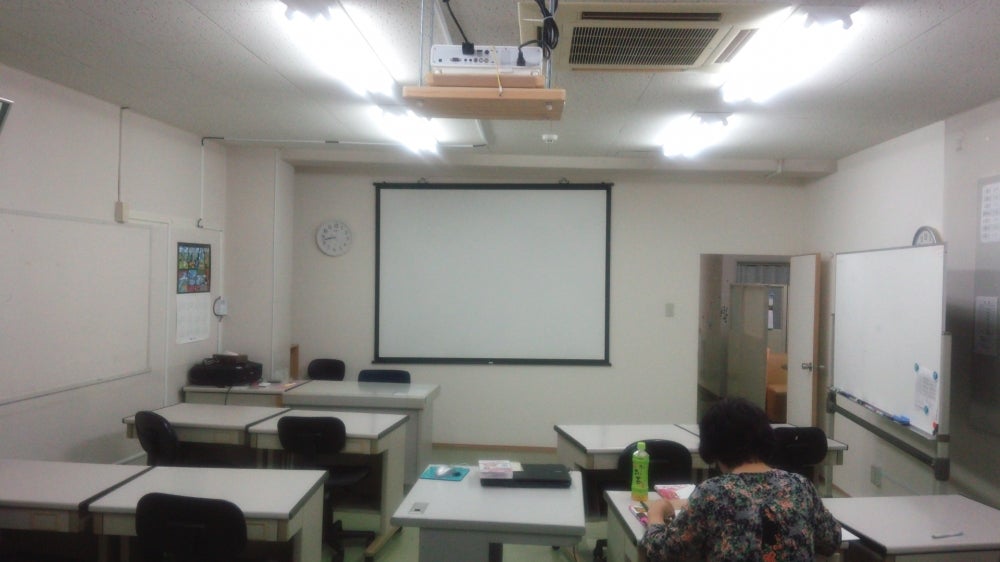
You are a GUI agent. You are given a task and a screenshot of the screen. Output one action in this format:
    pyautogui.click(x=<x>, y=<y>)
    Task: Click on the desk
    The image size is (1000, 562).
    Given the screenshot: What is the action you would take?
    pyautogui.click(x=976, y=519), pyautogui.click(x=905, y=529), pyautogui.click(x=499, y=516), pyautogui.click(x=455, y=512), pyautogui.click(x=271, y=512)